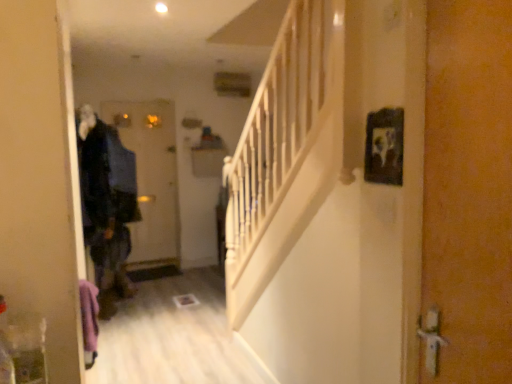
Question: Is the depth of matte black door at center, the second door viewed from the front, greater than that of orange textured door at right, which is the first door from right to left?

Choices:
 (A) no
 (B) yes

Answer: (B)

Question: From the image's perspective, does matte black door at center, the second door viewed from the front, appear lower than orange textured door at right, arranged as the first door when viewed from the front?

Choices:
 (A) yes
 (B) no

Answer: (B)

Question: Is matte black door at center, the second door viewed from the front, closer to the viewer compared to orange textured door at right, which is the first door from right to left?

Choices:
 (A) no
 (B) yes

Answer: (A)

Question: Does matte black door at center, which is the first door in left-to-right order, touch orange textured door at right, which is the 2th door from back to front?

Choices:
 (A) no
 (B) yes

Answer: (A)

Question: Is matte black door at center, the second door when ordered from right to left, bigger than orange textured door at right, which is the first door from right to left?

Choices:
 (A) no
 (B) yes

Answer: (B)

Question: From the image's perspective, is black matte picture frame at upper right positioned above or below matte black door at center, the second door viewed from the front?

Choices:
 (A) above
 (B) below

Answer: (A)

Question: Considering the positions of black matte picture frame at upper right and matte black door at center, which is the first door in left-to-right order, in the image, is black matte picture frame at upper right wider or thinner than matte black door at center, which is the first door in left-to-right order,?

Choices:
 (A) wide
 (B) thin

Answer: (B)

Question: Is black matte picture frame at upper right taller or shorter than matte black door at center, which is the first door in left-to-right order?

Choices:
 (A) short
 (B) tall

Answer: (A)

Question: Does point (392, 167) appear closer or farther from the camera than point (159, 233)?

Choices:
 (A) closer
 (B) farther

Answer: (A)

Question: Is black matte picture frame at upper right spatially inside dark blue fabric coat at left, or outside of it?

Choices:
 (A) outside
 (B) inside

Answer: (A)

Question: From the image's perspective, is black matte picture frame at upper right positioned above or below dark blue fabric coat at left?

Choices:
 (A) above
 (B) below

Answer: (B)

Question: From their relative heights in the image, would you say black matte picture frame at upper right is taller or shorter than dark blue fabric coat at left?

Choices:
 (A) short
 (B) tall

Answer: (A)

Question: Is point (393, 183) closer or farther from the camera than point (109, 226)?

Choices:
 (A) farther
 (B) closer

Answer: (B)

Question: From a real-world perspective, is matte black door at center, placed as the 1th door when sorted from back to front, physically located above or below orange textured door at right, marked as the 2th door in a left-to-right arrangement?

Choices:
 (A) below
 (B) above

Answer: (A)

Question: Considering the positions of point (140, 168) and point (464, 6), is point (140, 168) closer or farther from the camera than point (464, 6)?

Choices:
 (A) closer
 (B) farther

Answer: (B)